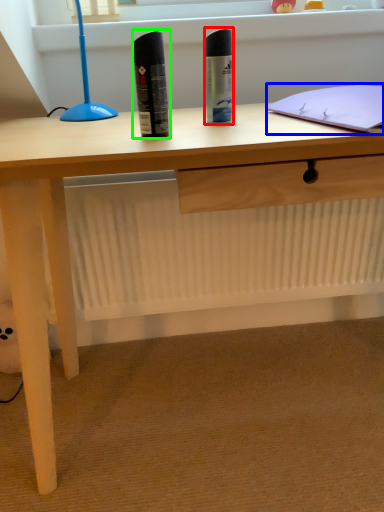
Question: Which object is the farthest from stationery (highlighted by a red box)? Choose among these: notebook (highlighted by a blue box) or stationery (highlighted by a green box).

Choices:
 (A) notebook
 (B) stationery

Answer: (A)